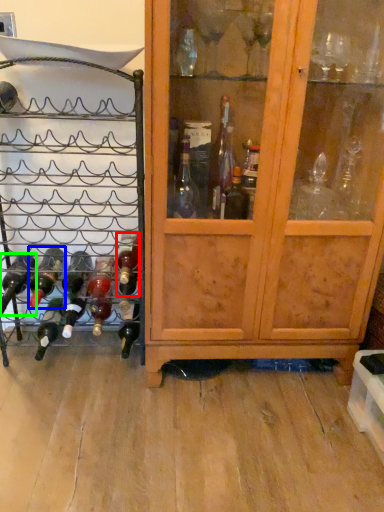
Question: Considering the real-world distances, which object is closest to bottle (highlighted by a red box)? bottle (highlighted by a blue box) or bottle (highlighted by a green box).

Choices:
 (A) bottle
 (B) bottle

Answer: (A)